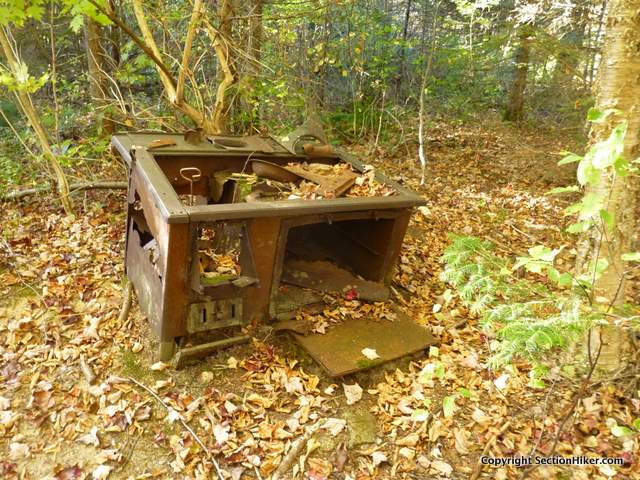
Locate an element on the screen. This screenshot has width=640, height=480. old stove is located at coordinates (276, 214).